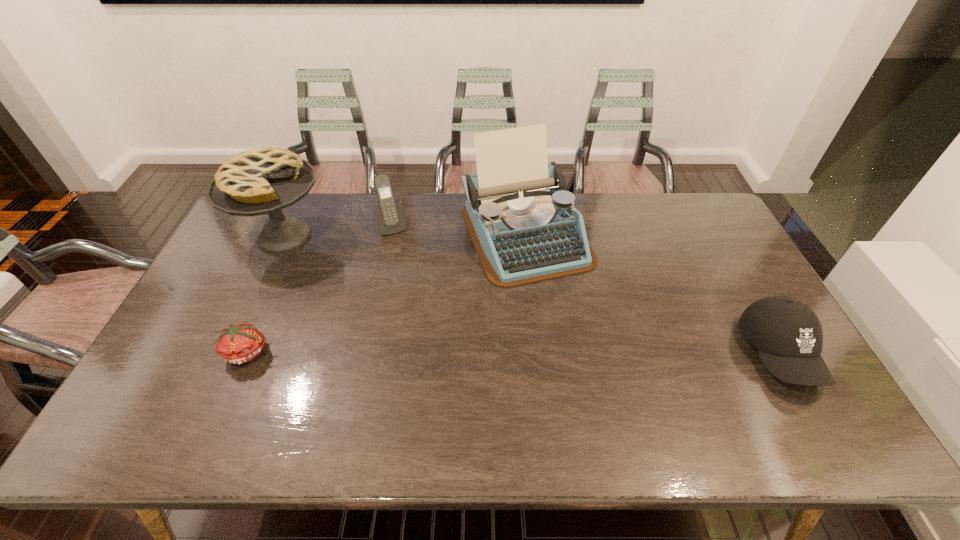
This screenshot has height=540, width=960. I want to click on free space at the near right corner, so click(756, 390).

The width and height of the screenshot is (960, 540). What are the coordinates of `free space that is in between the cellular telephone and the second shortest object` in the screenshot? It's located at (587, 290).

This screenshot has width=960, height=540. What are the coordinates of `free point between the tomato and the pie` in the screenshot? It's located at (266, 294).

You are a GUI agent. You are given a task and a screenshot of the screen. Output one action in this format:
    pyautogui.click(x=<x>, y=<y>)
    Task: Click on the empty space between the baseball cap and the fourth object from left to right
    This screenshot has height=540, width=960.
    Given the screenshot: What is the action you would take?
    pyautogui.click(x=653, y=294)

Locate an element on the screen. free space between the pie and the baseball cap is located at coordinates (532, 295).

Where is `free space between the rightmost object and the shortest object`? The width and height of the screenshot is (960, 540). free space between the rightmost object and the shortest object is located at coordinates (514, 353).

Identify the location of free spot between the third object from right to left and the second object from right to left. (460, 231).

The width and height of the screenshot is (960, 540). I want to click on blank region between the cellular telephone and the pie, so click(x=339, y=231).

Identify the location of unoccupied position between the pie and the rightmost object. (532, 295).

Locate an element on the screen. Image resolution: width=960 pixels, height=540 pixels. free space between the shortest object and the third shortest object is located at coordinates (320, 289).